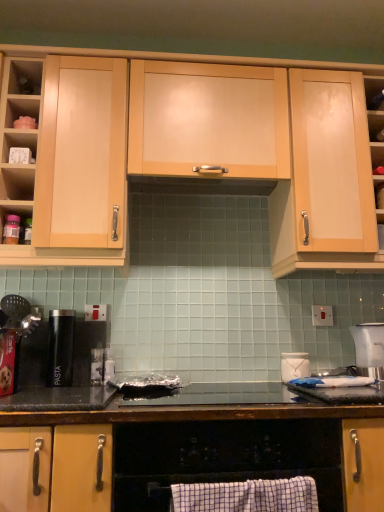
This screenshot has height=512, width=384. Describe the element at coordinates (19, 143) in the screenshot. I see `white plastic clock at upper left, which appears as the 2th shelf when viewed from the top` at that location.

What is the approximate height of wooden cabinet at lower center, which is the 4th cabinetry from top to bottom?

The height of wooden cabinet at lower center, which is the 4th cabinetry from top to bottom, is 20.30 inches.

You are a GUI agent. You are given a task and a screenshot of the screen. Output one action in this format:
    pyautogui.click(x=<x>, y=<y>)
    Task: Click on the light wood cabinet at upper right, the 2th cabinetry in the bottom-to-top sequence
    This screenshot has height=512, width=384.
    Given the screenshot: What is the action you would take?
    pyautogui.click(x=326, y=178)

I want to click on wooden shelf at upper right, the 1th shelf positioned from the right, so (x=379, y=194).

Locate an element on the screen. The image size is (384, 512). white plastic clock at upper left, marked as the second shelf in a left-to-right arrangement is located at coordinates (19, 143).

Would you say matte wood cabinet at left, which is counted as the 3th cabinetry, starting from the bottom, is part of matte wood cabinet at center, which is the 1th cabinetry from top to bottom,'s contents?

That's incorrect, matte wood cabinet at left, which is counted as the 3th cabinetry, starting from the bottom, is not inside matte wood cabinet at center, which is the 1th cabinetry from top to bottom.

From the picture: Does matte wood cabinet at center, which is the 1th cabinetry from top to bottom, turn towards matte wood cabinet at left, the 2th cabinetry in the top-to-bottom sequence?

No, matte wood cabinet at center, which is the 1th cabinetry from top to bottom, is not facing towards matte wood cabinet at left, the 2th cabinetry in the top-to-bottom sequence.

Is point (174, 119) behind point (99, 175)?

Yes, it is behind point (99, 175).

Who is smaller, matte wood cabinet at center, which is the 1th cabinetry from top to bottom, or matte wood cabinet at left, which is counted as the 3th cabinetry, starting from the bottom?

Smaller between the two is matte wood cabinet at center, which is the 1th cabinetry from top to bottom.

Which is correct: black matte pasta canister at left is inside white plastic clock at upper left, marked as the second shelf in a right-to-left arrangement, or outside of it?

black matte pasta canister at left is outside white plastic clock at upper left, marked as the second shelf in a right-to-left arrangement.

Between black matte pasta canister at left and white plastic clock at upper left, marked as the second shelf in a right-to-left arrangement, which one is positioned in front?

white plastic clock at upper left, marked as the second shelf in a right-to-left arrangement, is in front.

From a real-world perspective, which is physically below, black matte pasta canister at left or white plastic clock at upper left, which appears as the 2th shelf when viewed from the top?

From a 3D spatial view, black matte pasta canister at left is below.

Is the depth of light wood cabinet at upper right, marked as the third cabinetry in a top-to-bottom arrangement, less than that of matte wood cabinet at left, the 2th cabinetry in the top-to-bottom sequence?

No, it is not.

From the image's perspective, would you say light wood cabinet at upper right, marked as the third cabinetry in a top-to-bottom arrangement, is positioned over matte wood cabinet at left, the 2th cabinetry in the top-to-bottom sequence?

Actually, light wood cabinet at upper right, marked as the third cabinetry in a top-to-bottom arrangement, appears below matte wood cabinet at left, the 2th cabinetry in the top-to-bottom sequence, in the image.

What's the angular difference between light wood cabinet at upper right, marked as the third cabinetry in a top-to-bottom arrangement, and matte wood cabinet at left, the 2th cabinetry in the top-to-bottom sequence,'s facing directions?

light wood cabinet at upper right, marked as the third cabinetry in a top-to-bottom arrangement, and matte wood cabinet at left, the 2th cabinetry in the top-to-bottom sequence, are facing 2.71e-05 degrees away from each other.

Measure the distance between light wood cabinet at upper right, the 2th cabinetry in the bottom-to-top sequence, and matte wood cabinet at left, which is counted as the 3th cabinetry, starting from the bottom.

30.05 inches.

From a real-world perspective, is light wood cabinet at upper right, marked as the third cabinetry in a top-to-bottom arrangement, over wooden cabinet at lower center, the first cabinetry positioned from the bottom?

Correct, in the physical world, light wood cabinet at upper right, marked as the third cabinetry in a top-to-bottom arrangement, is higher than wooden cabinet at lower center, the first cabinetry positioned from the bottom.

Who is shorter, light wood cabinet at upper right, the 2th cabinetry in the bottom-to-top sequence, or wooden cabinet at lower center, the first cabinetry positioned from the bottom?

wooden cabinet at lower center, the first cabinetry positioned from the bottom.

Is light wood cabinet at upper right, the 2th cabinetry in the bottom-to-top sequence, closer to the viewer compared to wooden cabinet at lower center, the first cabinetry positioned from the bottom?

No.

How much distance is there between light wood cabinet at upper right, the 2th cabinetry in the bottom-to-top sequence, and wooden cabinet at lower center, the first cabinetry positioned from the bottom?

light wood cabinet at upper right, the 2th cabinetry in the bottom-to-top sequence, is 33.73 inches away from wooden cabinet at lower center, the first cabinetry positioned from the bottom.

Is white plastic electric outlet at center right oriented away from light wood cabinet at upper right, marked as the third cabinetry in a top-to-bottom arrangement?

No.

How far apart are white plastic electric outlet at center right and light wood cabinet at upper right, the 2th cabinetry in the bottom-to-top sequence?

white plastic electric outlet at center right and light wood cabinet at upper right, the 2th cabinetry in the bottom-to-top sequence, are 21.69 inches apart.

Does point (320, 311) come in front of point (361, 166)?

No.

What's the angular difference between white plastic electric outlet at center right and light wood cabinet at upper right, marked as the third cabinetry in a top-to-bottom arrangement,'s facing directions?

white plastic electric outlet at center right and light wood cabinet at upper right, marked as the third cabinetry in a top-to-bottom arrangement, are facing 0.143 degrees away from each other.

From a real-world perspective, relative to black matte pasta canister at left, is wooden shelf at upper right, which is counted as the first shelf, starting from the bottom, vertically above or below?

From a real-world perspective, wooden shelf at upper right, which is counted as the first shelf, starting from the bottom, is physically above black matte pasta canister at left.

How distant is wooden shelf at upper right, which is counted as the first shelf, starting from the bottom, from black matte pasta canister at left?

The distance of wooden shelf at upper right, which is counted as the first shelf, starting from the bottom, from black matte pasta canister at left is 1.31 meters.

From the image's perspective, is wooden shelf at upper right, the third shelf from the top, below black matte pasta canister at left?

Incorrect, from the image's perspective, wooden shelf at upper right, the third shelf from the top, is higher than black matte pasta canister at left.

Is wooden shelf at upper right, the third shelf from the top, turned away from black matte pasta canister at left?

No, wooden shelf at upper right, the third shelf from the top, is not facing away from black matte pasta canister at left.

Does wooden cabinet at lower center, the first cabinetry positioned from the bottom, have a larger size compared to white glossy jar at upper right?

Indeed, wooden cabinet at lower center, the first cabinetry positioned from the bottom, has a larger size compared to white glossy jar at upper right.

Relative to white glossy jar at upper right, is wooden cabinet at lower center, which is the 4th cabinetry from top to bottom, in front or behind?

wooden cabinet at lower center, which is the 4th cabinetry from top to bottom, is in front of white glossy jar at upper right.

Does point (362, 439) come in front of point (296, 354)?

Yes, it is.

In the scene shown: Considering the relative sizes of wooden cabinet at lower center, the first cabinetry positioned from the bottom, and white glossy jar at upper right in the image provided, is wooden cabinet at lower center, the first cabinetry positioned from the bottom, shorter than white glossy jar at upper right?

No.

Identify the location of the 1st cabinetry counting from the right side of the matte wood cabinet at left, the 2th cabinetry in the top-to-bottom sequence. The image size is (384, 512). (208, 119).

The image size is (384, 512). I want to click on appliance below the white plastic clock at upper left, which appears as the 2th shelf when viewed from the top (from a real-world perspective), so click(x=60, y=347).

Considering their positions, is white plastic clock at upper left, which appears as the 2th shelf when viewed from the top, positioned closer to black matte pasta canister at left than matte plastic shelf at upper left, the 1th shelf positioned from the left?

The object closer to black matte pasta canister at left is white plastic clock at upper left, which appears as the 2th shelf when viewed from the top.

Looking at the image, which one is located further to wooden cabinet at lower center, which is the 4th cabinetry from top to bottom, matte plastic shelf at upper left, the 3th shelf in the right-to-left sequence, or black matte pasta canister at left?

Based on the image, matte plastic shelf at upper left, the 3th shelf in the right-to-left sequence, appears to be further to wooden cabinet at lower center, which is the 4th cabinetry from top to bottom.

When comparing their distances from white plastic clock at upper left, marked as the second shelf in a right-to-left arrangement, does matte wood cabinet at center, marked as the fourth cabinetry in a bottom-to-top arrangement, or black matte pasta canister at left seem further?

black matte pasta canister at left is positioned further to the anchor white plastic clock at upper left, marked as the second shelf in a right-to-left arrangement.

Based on their spatial positions, is black matte pasta canister at left or matte wood cabinet at center, which is the 1th cabinetry from top to bottom, further from light wood cabinet at upper right, marked as the third cabinetry in a top-to-bottom arrangement?

black matte pasta canister at left is positioned further to the anchor light wood cabinet at upper right, marked as the third cabinetry in a top-to-bottom arrangement.

Based on their spatial positions, is wooden shelf at upper right, the third shelf from the top, or black matte pasta canister at left closer to wooden cabinet at lower center, the first cabinetry positioned from the bottom?

black matte pasta canister at left is closer to wooden cabinet at lower center, the first cabinetry positioned from the bottom.

When comparing their distances from matte plastic shelf at upper left, the 3th shelf in the right-to-left sequence, does white plastic electric outlet at center right or white glossy jar at upper right seem closer?

The object closer to matte plastic shelf at upper left, the 3th shelf in the right-to-left sequence, is white glossy jar at upper right.

Which object lies nearer to the anchor point white plastic blender at right, white plastic clock at upper left, marked as the second shelf in a left-to-right arrangement, or light wood cabinet at upper right, the 2th cabinetry in the bottom-to-top sequence?

Based on the image, light wood cabinet at upper right, the 2th cabinetry in the bottom-to-top sequence, appears to be nearer to white plastic blender at right.

Considering their positions, is matte plastic shelf at upper left, the 3th shelf positioned from the bottom, positioned closer to matte wood cabinet at left, which is counted as the 3th cabinetry, starting from the bottom, than white plastic electric outlet at center right?

matte plastic shelf at upper left, the 3th shelf positioned from the bottom, is closer to matte wood cabinet at left, which is counted as the 3th cabinetry, starting from the bottom.

Identify the location of shelf between light wood cabinet at upper right, the 2th cabinetry in the bottom-to-top sequence, and wooden cabinet at lower center, which is the 4th cabinetry from top to bottom, in the up-down direction. coord(379,194).

This screenshot has height=512, width=384. Identify the location of electric outlet between matte plastic shelf at upper left, the 1th shelf positioned from the left, and light wood cabinet at upper right, marked as the third cabinetry in a top-to-bottom arrangement, from left to right. (322, 315).

This screenshot has height=512, width=384. I want to click on kitchen appliance between white plastic clock at upper left, which appears as the 2th shelf when viewed from the top, and wooden cabinet at lower center, which is the 4th cabinetry from top to bottom, vertically, so click(294, 366).

Where is `appliance situated between white plastic clock at upper left, marked as the second shelf in a left-to-right arrangement, and white plastic blender at right from left to right`? This screenshot has width=384, height=512. appliance situated between white plastic clock at upper left, marked as the second shelf in a left-to-right arrangement, and white plastic blender at right from left to right is located at coordinates (60, 347).